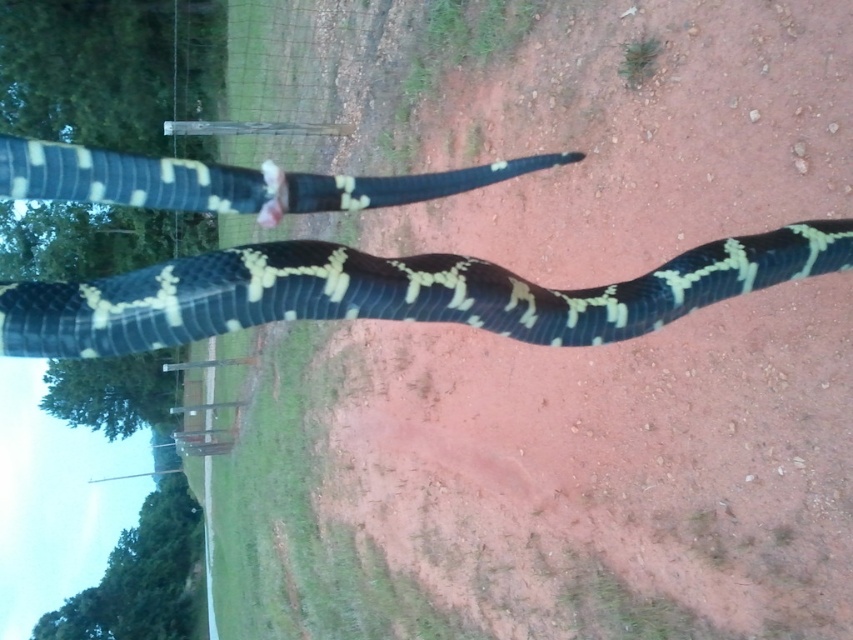
Question: Which of the following is the closest to the observer?

Choices:
 (A) (13, 186)
 (B) (132, 321)

Answer: (B)

Question: Does black/yellow scales snake at center have a smaller size compared to black/yellow scales at upper center?

Choices:
 (A) no
 (B) yes

Answer: (A)

Question: Which object is closer to the camera taking this photo?

Choices:
 (A) black/yellow scales snake at center
 (B) black/yellow scales at upper center

Answer: (A)

Question: Among these objects, which one is farthest from the camera?

Choices:
 (A) black/yellow scales snake at center
 (B) black/yellow scales at upper center

Answer: (B)

Question: Does black/yellow scales snake at center have a lesser width compared to black/yellow scales at upper center?

Choices:
 (A) yes
 (B) no

Answer: (B)

Question: Is black/yellow scales snake at center closer to the viewer compared to black/yellow scales at upper center?

Choices:
 (A) no
 (B) yes

Answer: (B)